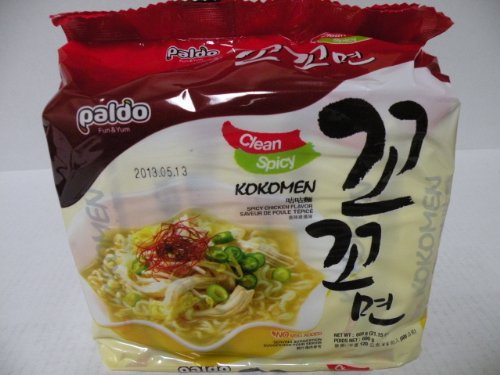
Locate an element on the screen. The image size is (500, 375). white bowl is located at coordinates (209, 350).